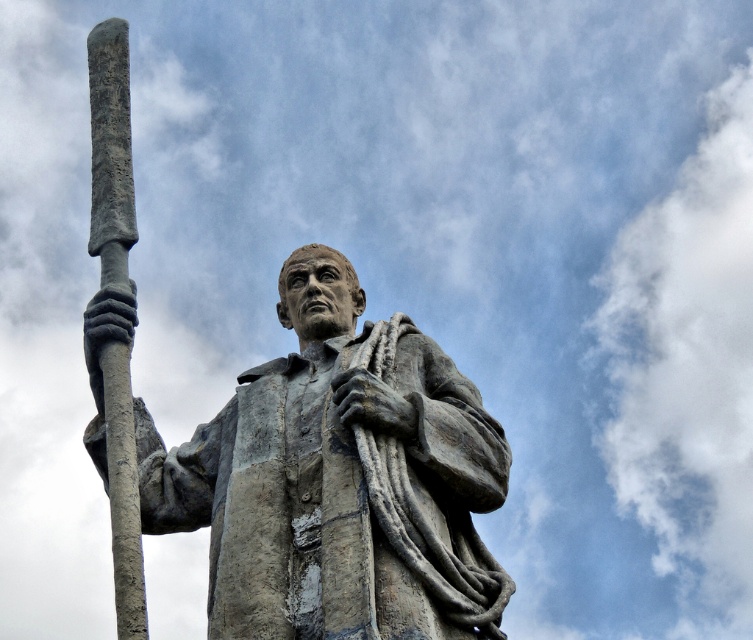
Question: Can you confirm if bronze statue at center is smaller than gray stone spear at left?

Choices:
 (A) no
 (B) yes

Answer: (A)

Question: Which point appears farthest from the camera in this image?

Choices:
 (A) (114, 388)
 (B) (290, 323)

Answer: (B)

Question: In this image, where is bronze statue at center located relative to gray stone spear at left?

Choices:
 (A) below
 (B) above

Answer: (A)

Question: Can you confirm if bronze statue at center is bigger than gray stone spear at left?

Choices:
 (A) yes
 (B) no

Answer: (A)

Question: Which object is farther from the camera taking this photo?

Choices:
 (A) gray stone spear at left
 (B) bronze statue at center

Answer: (A)